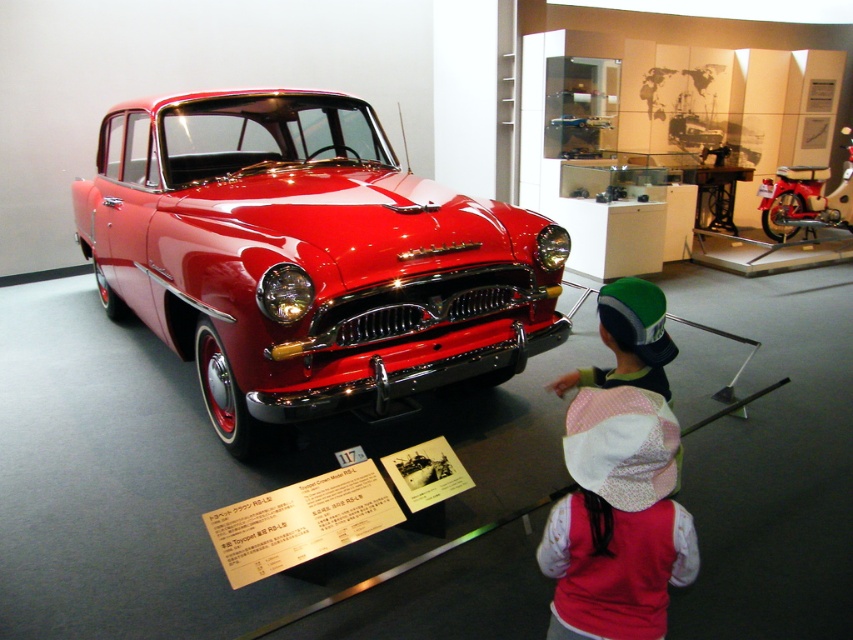
What are the coordinates of the shiny red car at center?

The shiny red car at center is located at coordinates point [306,259].

You are a tour guide in the museum and need to direct visitors to the shiny red car at center. A visitor asks where it is relative to the pink fabric hat at lower center. How would you describe its position?

The shiny red car at center is located above the pink fabric hat at lower center, so you can find it by looking upwards from the hat.

You are a photographer standing in front of the shiny red car at center and the pink fabric hat at lower center. You want to take a photo that includes both objects in focus. Which object should you focus on to ensure both are sharp?

You should focus on the shiny red car at center because it is closer to you than the pink fabric hat at lower center, so focusing on the closer object will keep both in focus.